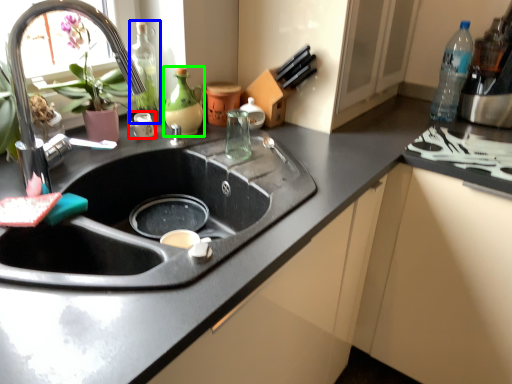
Question: Estimate the real-world distances between objects in this image. Which object is closer to appliance (highlighted by a red box), bottle (highlighted by a blue box) or bottle (highlighted by a green box)?

Choices:
 (A) bottle
 (B) bottle

Answer: (A)